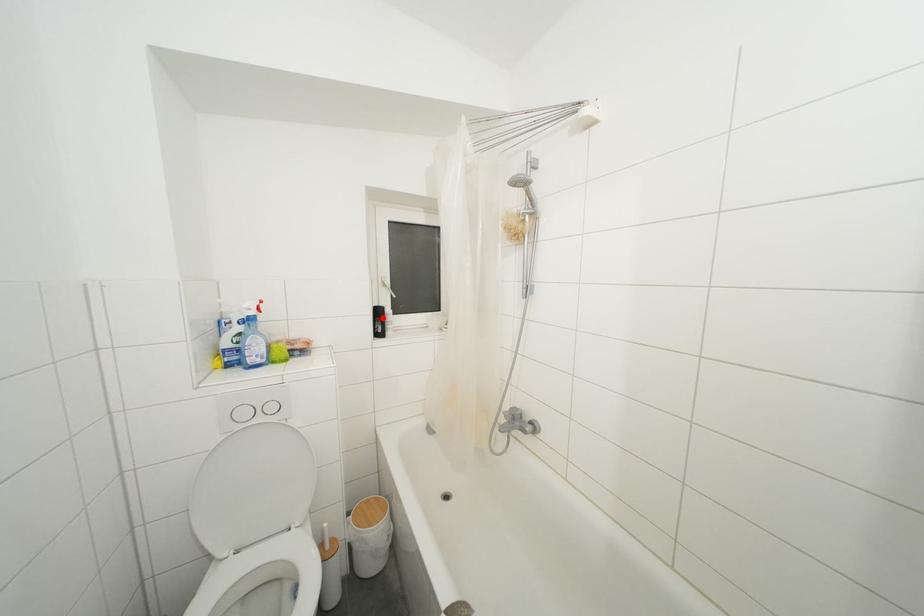
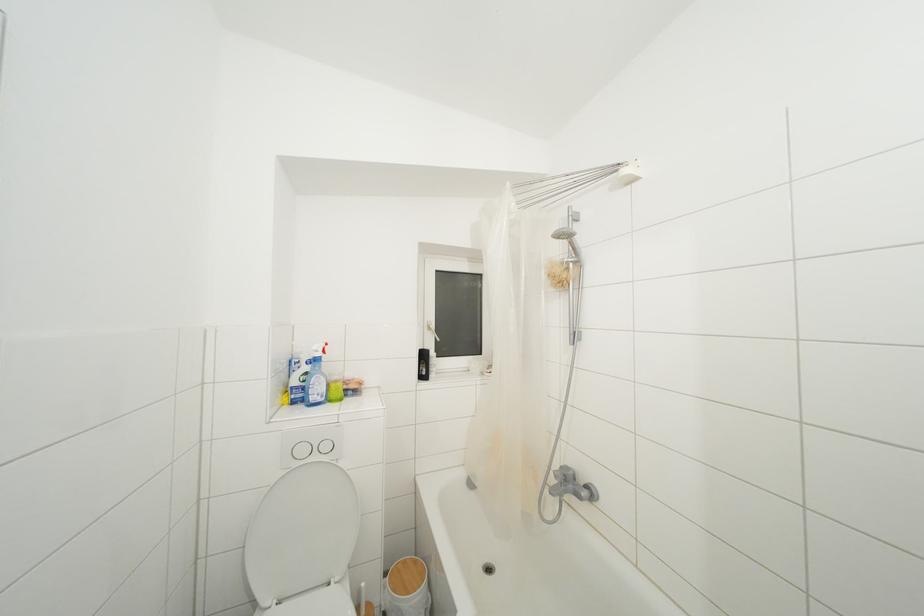
The point at the highlighted location is marked in the first image. Where is the corresponding point in the second image?

(428, 361)